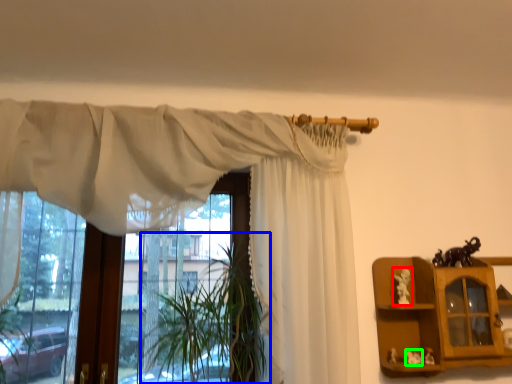
Question: Which is nearer to the toy (highlighted by a red box)? plant (highlighted by a blue box) or toy (highlighted by a green box).

Choices:
 (A) plant
 (B) toy

Answer: (B)